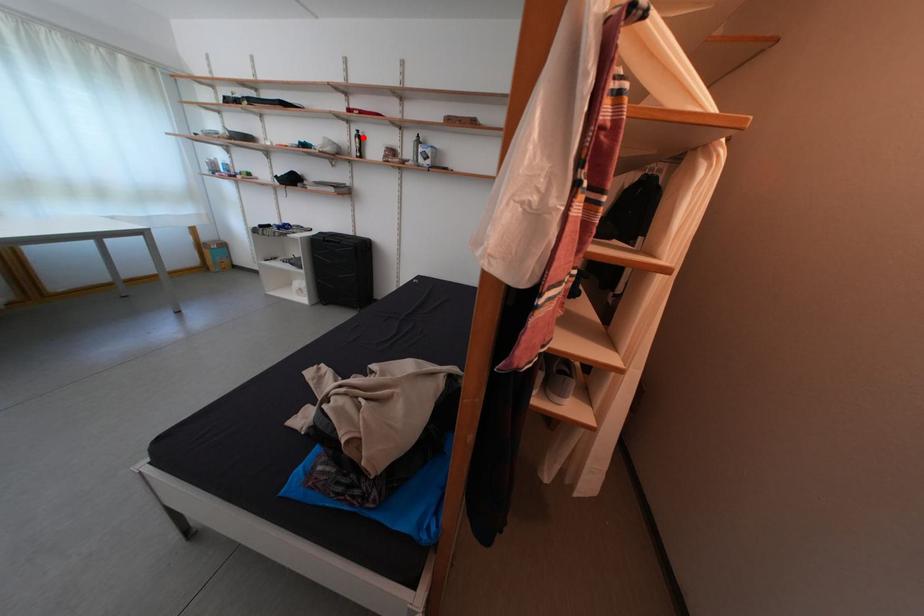
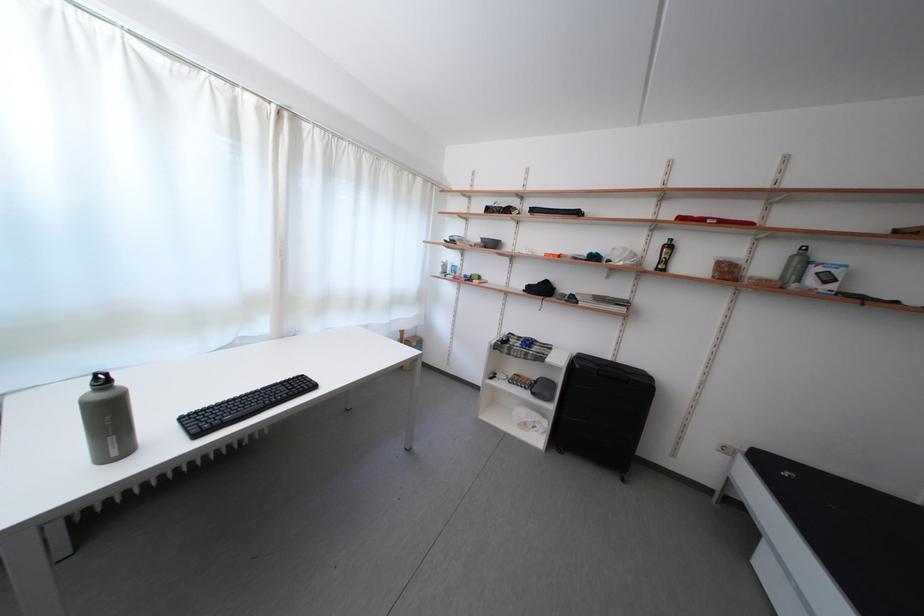
In the second image, find the point that corresponds to the highlighted location in the first image.

(669, 246)